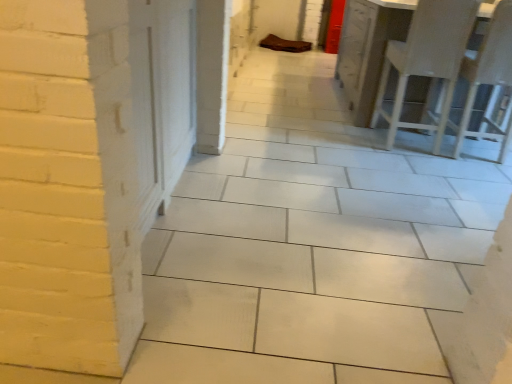
Question: Is the position of white wood chairs at right less distant than that of white plastic chair at right?

Choices:
 (A) yes
 (B) no

Answer: (B)

Question: Does white wood chairs at right have a larger size compared to white plastic chair at right?

Choices:
 (A) yes
 (B) no

Answer: (A)

Question: Is white wood chairs at right further to the viewer compared to white plastic chair at right?

Choices:
 (A) yes
 (B) no

Answer: (A)

Question: Does white wood chairs at right have a lesser width compared to white plastic chair at right?

Choices:
 (A) yes
 (B) no

Answer: (A)

Question: Does white wood chairs at right contain white plastic chair at right?

Choices:
 (A) yes
 (B) no

Answer: (B)

Question: Is white wood chairs at right directly adjacent to white plastic chair at right?

Choices:
 (A) no
 (B) yes

Answer: (A)

Question: Is white plastic chair at right directly adjacent to white wood chairs at right?

Choices:
 (A) yes
 (B) no

Answer: (B)

Question: Is white plastic chair at right looking in the opposite direction of white wood chairs at right?

Choices:
 (A) yes
 (B) no

Answer: (B)

Question: Does white plastic chair at right appear on the right side of white wood chairs at right?

Choices:
 (A) no
 (B) yes

Answer: (B)

Question: Does white plastic chair at right come in front of white wood chairs at right?

Choices:
 (A) yes
 (B) no

Answer: (A)

Question: Is white plastic chair at right taller than white wood chairs at right?

Choices:
 (A) no
 (B) yes

Answer: (B)

Question: Is white wood chairs at right a part of white plastic chair at right?

Choices:
 (A) no
 (B) yes

Answer: (A)

Question: Is white wood chairs at right wider or thinner than white plastic chair at right?

Choices:
 (A) wide
 (B) thin

Answer: (B)